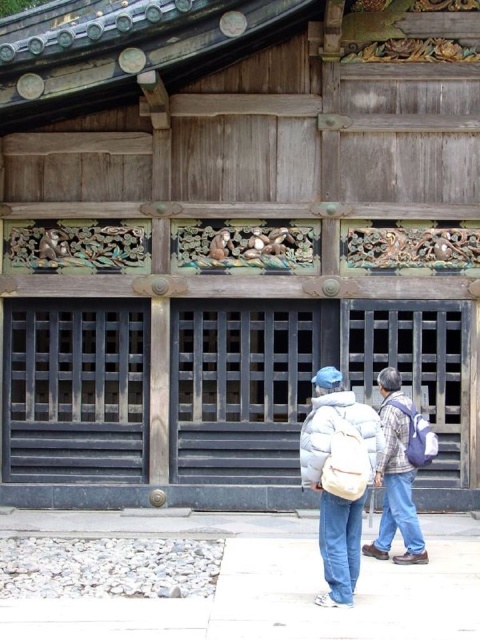
Question: In this image, where is light blue denim jeans at center located relative to blue fabric backpack at right?

Choices:
 (A) right
 (B) left

Answer: (B)

Question: Which point appears farthest from the camera in this image?

Choices:
 (A) (314, 460)
 (B) (409, 422)

Answer: (B)

Question: Which of the following is the farthest from the observer?

Choices:
 (A) blue fabric backpack at right
 (B) white matte jacket at center
 (C) light blue denim jeans at center

Answer: (A)

Question: Is white matte jacket at center positioned before light blue denim jeans at center?

Choices:
 (A) no
 (B) yes

Answer: (B)

Question: Does white matte jacket at center appear on the right side of light blue denim jeans at center?

Choices:
 (A) yes
 (B) no

Answer: (B)

Question: Which point appears farthest from the camera in this image?

Choices:
 (A) (432, 433)
 (B) (396, 416)
 (C) (324, 483)

Answer: (A)